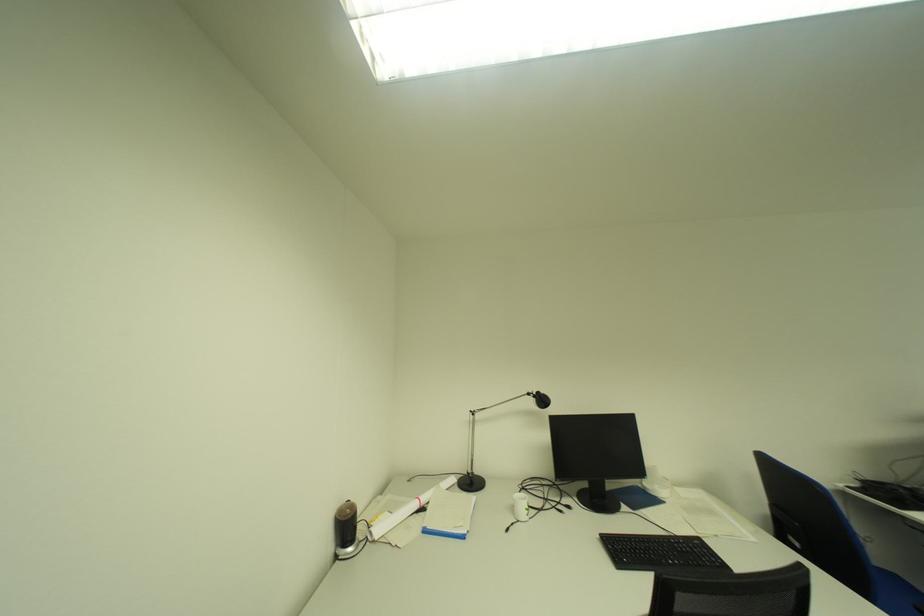
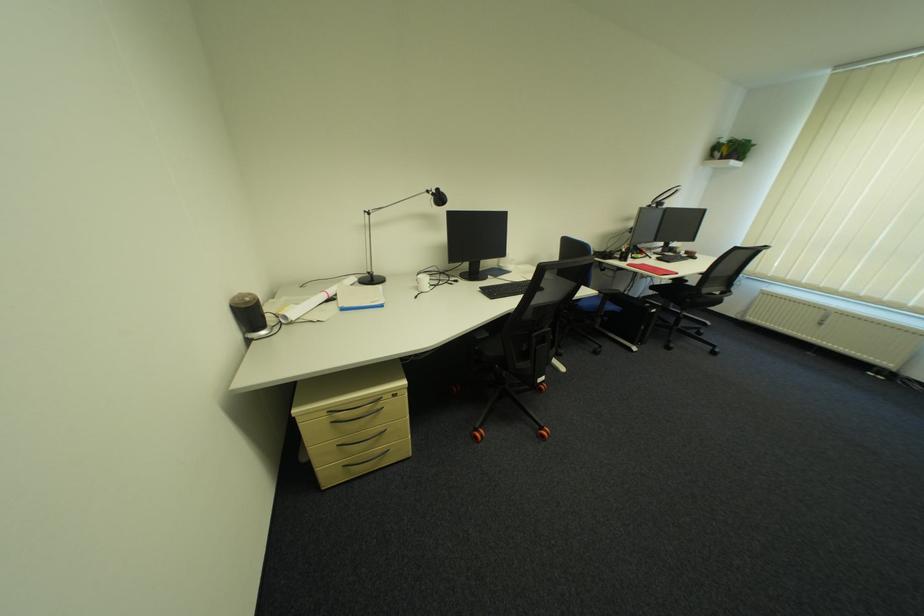
The first image is from the beginning of the video and the second image is from the end. How did the camera likely rotate when shooting the video?

The rotation direction of the camera is right-down.